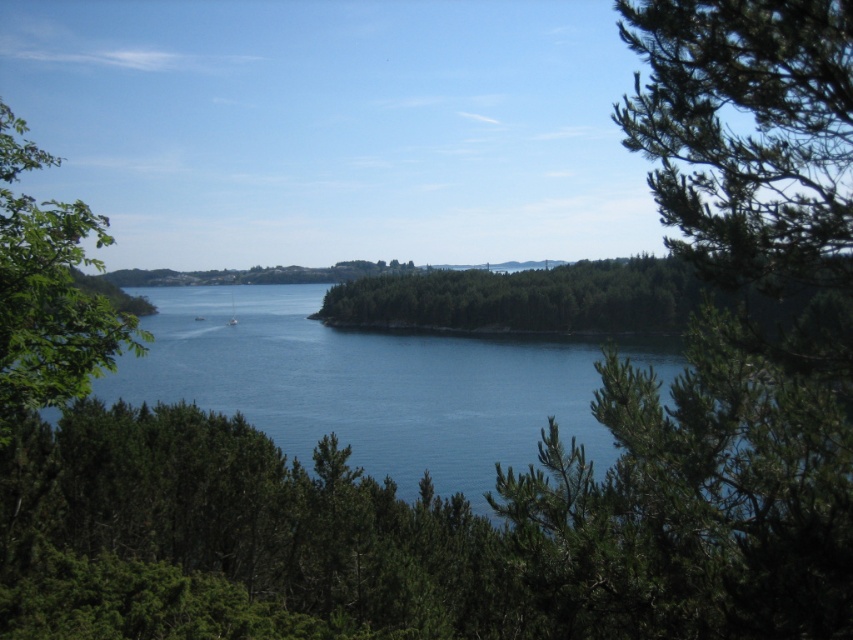
You are standing at the edge of the blue water at center and want to walk to the green leafy forest at center. Which direction should you go to reach the forest?

The green leafy forest at center is behind the blue water at center, so you should walk towards the direction away from the water to reach the forest.